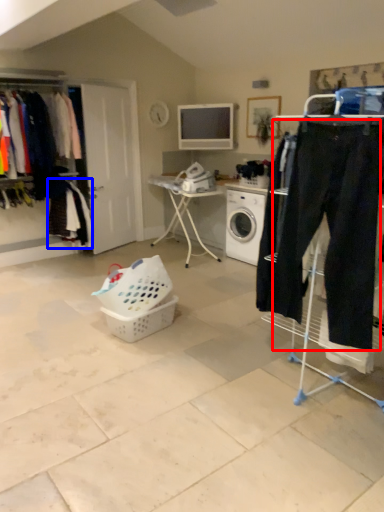
Question: Among these objects, which one is nearest to the camera, sweat pant (highlighted by a red box) or clothing (highlighted by a blue box)?

Choices:
 (A) sweat pant
 (B) clothing

Answer: (A)